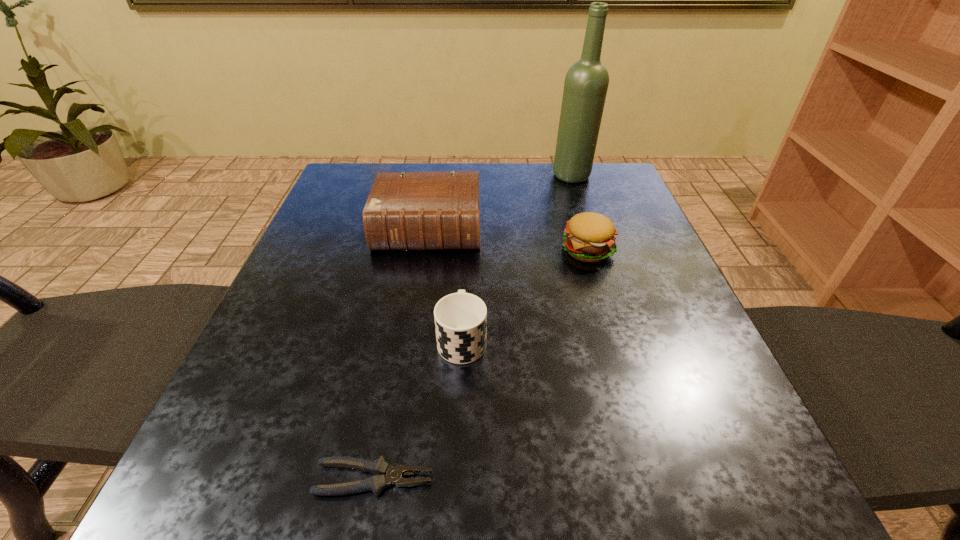
This screenshot has height=540, width=960. Identify the location of object that is at the far left corner. (x=405, y=211).

This screenshot has width=960, height=540. Find the location of `object at the far right corner`. object at the far right corner is located at coordinates (586, 83).

The image size is (960, 540). In the image, there is a desktop. What are the coordinates of `vacant space at the far edge` in the screenshot? It's located at (550, 207).

This screenshot has width=960, height=540. In order to click on blank area at the near edge in this screenshot , I will do `click(351, 512)`.

This screenshot has height=540, width=960. I want to click on vacant area at the left edge of the desktop, so pos(335,266).

Find the location of a particular element. This screenshot has width=960, height=540. free space at the right edge is located at coordinates (611, 336).

In the image, there is a desktop. In order to click on vacant space at the far right corner in this screenshot , I will do `click(634, 195)`.

You are a GUI agent. You are given a task and a screenshot of the screen. Output one action in this format:
    pyautogui.click(x=<x>, y=<y>)
    Task: Click on the free space at the near right corner of the desktop
    The image size is (960, 540).
    Given the screenshot: What is the action you would take?
    pyautogui.click(x=768, y=495)

This screenshot has height=540, width=960. In order to click on free spot between the shortest object and the hamburger in this screenshot , I will do `click(480, 364)`.

This screenshot has width=960, height=540. In order to click on free space between the wine bottle and the second nearest object in this screenshot , I will do `click(517, 258)`.